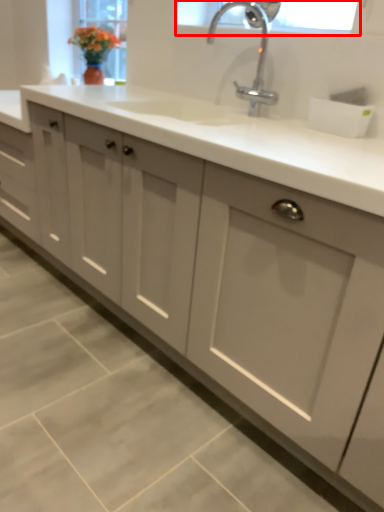
Question: From the image, what is the correct spatial relationship of window screen (annotated by the red box) in relation to tap?

Choices:
 (A) right
 (B) left

Answer: (A)